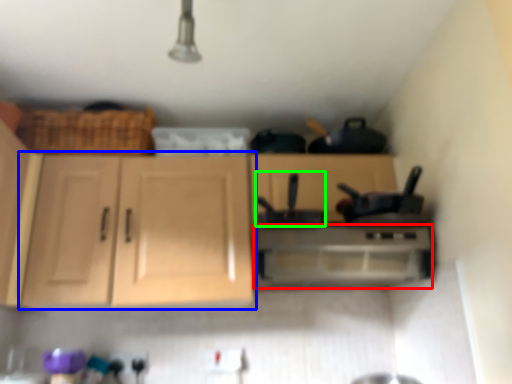
Question: Which object is positioned farthest from home appliance (highlighted by a red box)? Select from cabinetry (highlighted by a blue box) and appliance (highlighted by a green box).

Choices:
 (A) cabinetry
 (B) appliance

Answer: (A)